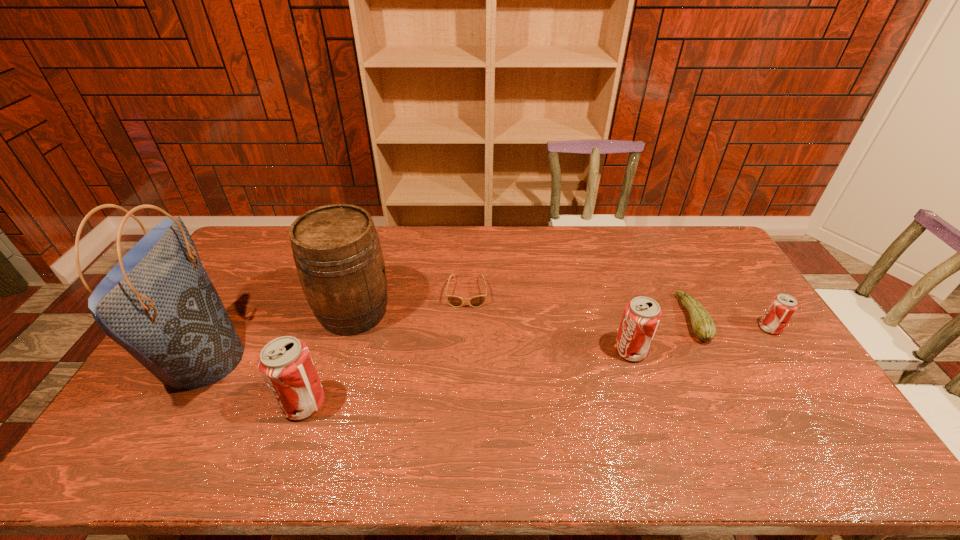
Identify the location of vacant space located on the back of the leftmost object. (251, 279).

Where is `soda can that is at the near edge`? soda can that is at the near edge is located at coordinates (285, 363).

You are a GUI agent. You are given a task and a screenshot of the screen. Output one action in this format:
    pyautogui.click(x=<x>, y=<y>)
    Task: Click on the shopping bag that is at the near edge
    
    Given the screenshot: What is the action you would take?
    pyautogui.click(x=158, y=303)

Where is `object that is at the left edge`? The image size is (960, 540). object that is at the left edge is located at coordinates (158, 303).

This screenshot has height=540, width=960. I want to click on object positioned at the right edge, so click(x=782, y=307).

Locate an element on the screen. object that is at the near left corner is located at coordinates (158, 303).

In the image, there is a desktop. Where is `vacant space at the far edge`? This screenshot has width=960, height=540. vacant space at the far edge is located at coordinates (523, 241).

Image resolution: width=960 pixels, height=540 pixels. In order to click on free region at the near edge of the desktop in this screenshot , I will do `click(231, 422)`.

Image resolution: width=960 pixels, height=540 pixels. Find the location of `vacant space at the right edge of the desktop`. vacant space at the right edge of the desktop is located at coordinates (737, 288).

Locate an element on the screen. The width and height of the screenshot is (960, 540). free space at the far left corner is located at coordinates (271, 254).